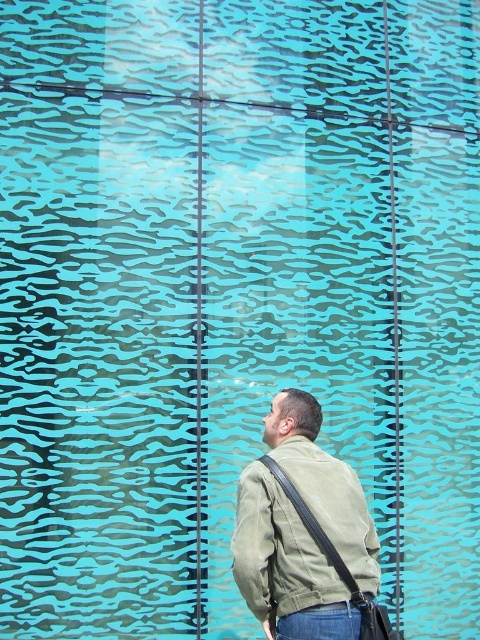
Does khaki fabric jacket at center appear on the left side of denim at lower center?

Incorrect, khaki fabric jacket at center is not on the left side of denim at lower center.

Is khaki fabric jacket at center wider than denim at lower center?

Correct, the width of khaki fabric jacket at center exceeds that of denim at lower center.

Does point (361, 528) come behind point (324, 634)?

Yes.

Locate an element on the screen. The image size is (480, 640). khaki fabric jacket at center is located at coordinates (285, 566).